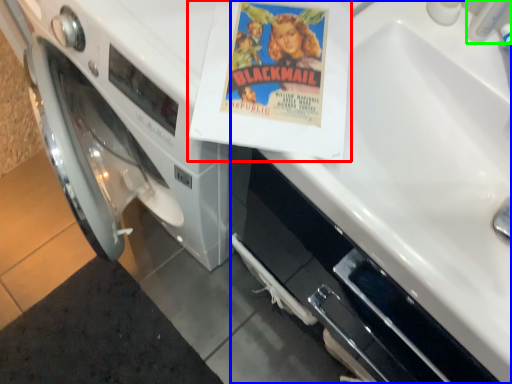
Question: Considering the real-world distances, which object is farthest from paperback book (highlighted by a red box)? sink (highlighted by a blue box) or faucet (highlighted by a green box)?

Choices:
 (A) sink
 (B) faucet

Answer: (A)